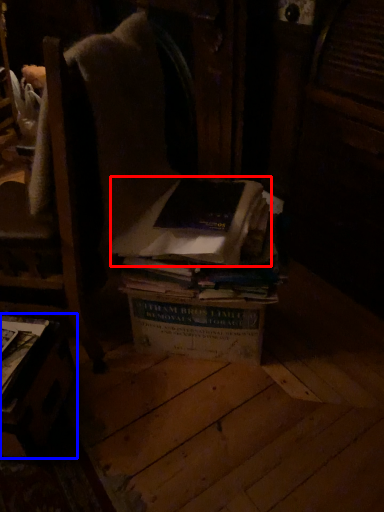
Question: Among these objects, which one is farthest to the camera, book (highlighted by a red box) or table (highlighted by a blue box)?

Choices:
 (A) book
 (B) table

Answer: (A)